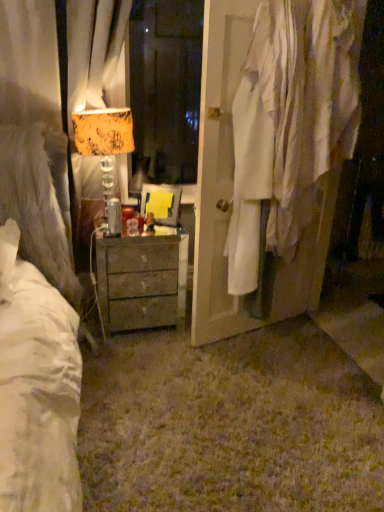
Question: Based on their sizes in the image, would you say rustic wood chest of drawers at center is bigger or smaller than white fabric at right?

Choices:
 (A) small
 (B) big

Answer: (A)

Question: From the image's perspective, is rustic wood chest of drawers at center above or below white fabric at right?

Choices:
 (A) below
 (B) above

Answer: (A)

Question: Which of these objects is positioned closest to the rustic wood chest of drawers at center?

Choices:
 (A) orange-patterned fabric lampshade at left
 (B) white fabric at right

Answer: (A)

Question: Which object is positioned farthest from the orange-patterned fabric lampshade at left?

Choices:
 (A) white fabric at right
 (B) rustic wood chest of drawers at center

Answer: (A)